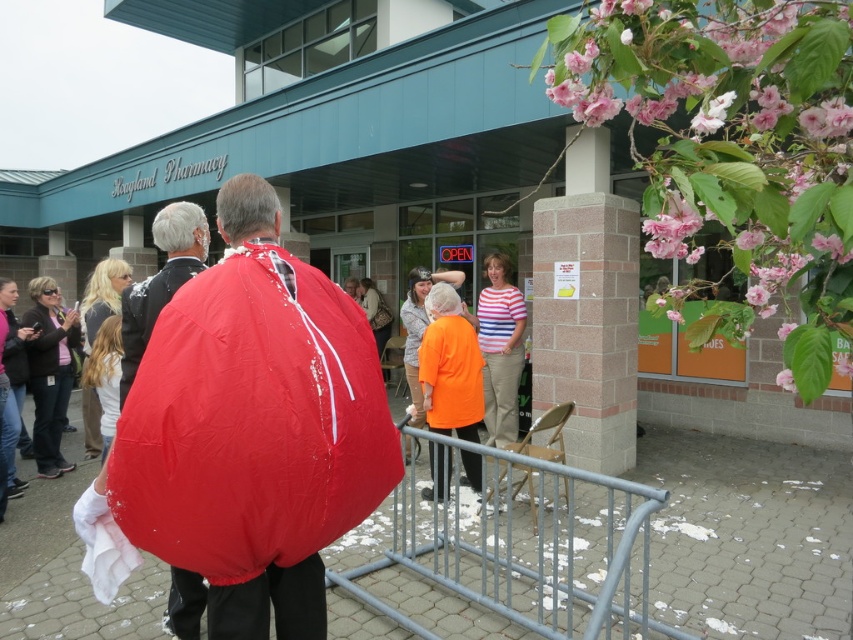
Question: In this image, where is matte nylon sleeping bag at center located relative to matte black jacket at lower left?

Choices:
 (A) above
 (B) below

Answer: (A)

Question: Which point is farther from the camera taking this photo?

Choices:
 (A) tap(138, 332)
 (B) tap(421, 632)
 (C) tap(38, 442)
 (D) tap(520, 300)

Answer: (D)

Question: Can you confirm if matte red cape at center is wider than orange fabric jacket at center?

Choices:
 (A) yes
 (B) no

Answer: (A)

Question: Estimate the real-world distances between objects in this image. Which object is farther from the matte black jacket at lower left?

Choices:
 (A) matte red cape at center
 (B) gray metal rail at center

Answer: (B)

Question: Which object is positioned closest to the striped fabric shirt at center?

Choices:
 (A) matte red cape at center
 (B) orange fabric jacket at center

Answer: (B)

Question: Can you confirm if matte red cape at center is positioned below striped fabric shirt at center?

Choices:
 (A) no
 (B) yes

Answer: (A)